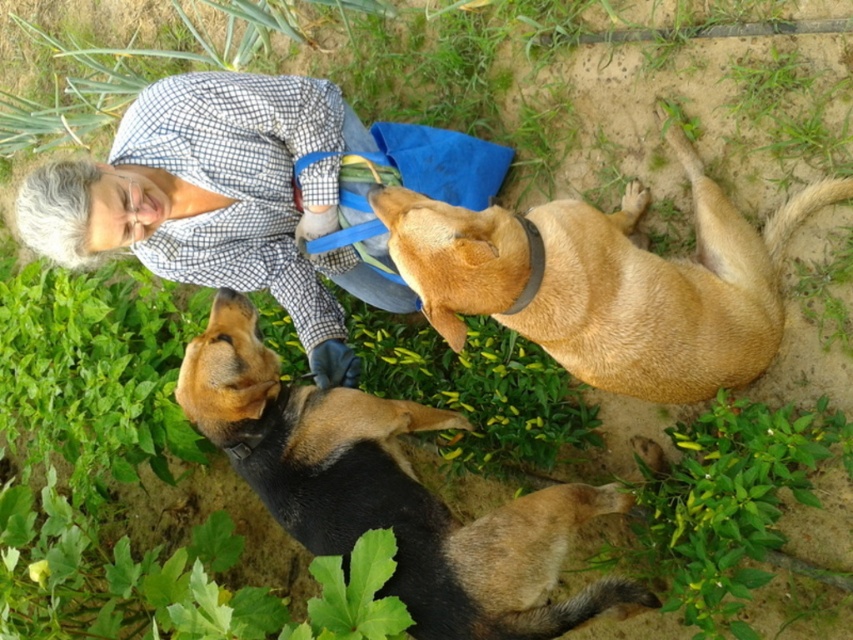
You are a photographer trying to capture a closeup of the black fur dog at lower center without the checkered fabric shirt at upper left blocking the view. Based on their positions, is this possible?

Yes, the black fur dog at lower center is closer to the viewer than the checkered fabric shirt at upper left, so the shirt won t block the dog in a closeup.

You are standing at the point marked by the coordinates point (403, 499). You want to throw a ball to a friend who is 10 feet away from you. Is your friend within reach?

The point (403, 499) is 8.23 feet away from the viewer. Since your friend is 10 feet away, they are beyond the distance of the point, so the friend is not within reach.

You are a photographer trying to capture a photo of the black fur dog at lower center and the checkered fabric shirt at upper left. Which object is wider in the image?

The black fur dog at lower center is wider than the checkered fabric shirt at upper left.